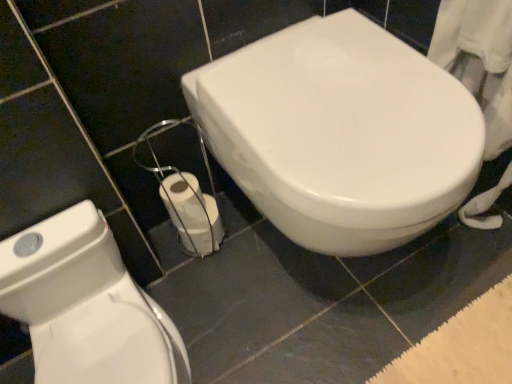
Question: Is white glossy toilet at lower left, the 2th toilet when ordered from right to left, bigger or smaller than white glossy toilet at center, the 2th toilet from the left?

Choices:
 (A) small
 (B) big

Answer: (A)

Question: In terms of height, does white glossy toilet at lower left, acting as the 1th toilet starting from the left, look taller or shorter compared to white glossy toilet at center, acting as the 1th toilet starting from the right?

Choices:
 (A) short
 (B) tall

Answer: (A)

Question: Which object is the farthest from the white matte toilet paper at lower center?

Choices:
 (A) white glossy toilet at lower left, the 2th toilet when ordered from right to left
 (B) white glossy toilet at center, the 2th toilet from the left

Answer: (B)

Question: Estimate the real-world distances between objects in this image. Which object is farther from the white matte toilet paper at lower center?

Choices:
 (A) white glossy toilet at lower left, acting as the 1th toilet starting from the left
 (B) white glossy toilet at center, acting as the 1th toilet starting from the right

Answer: (B)